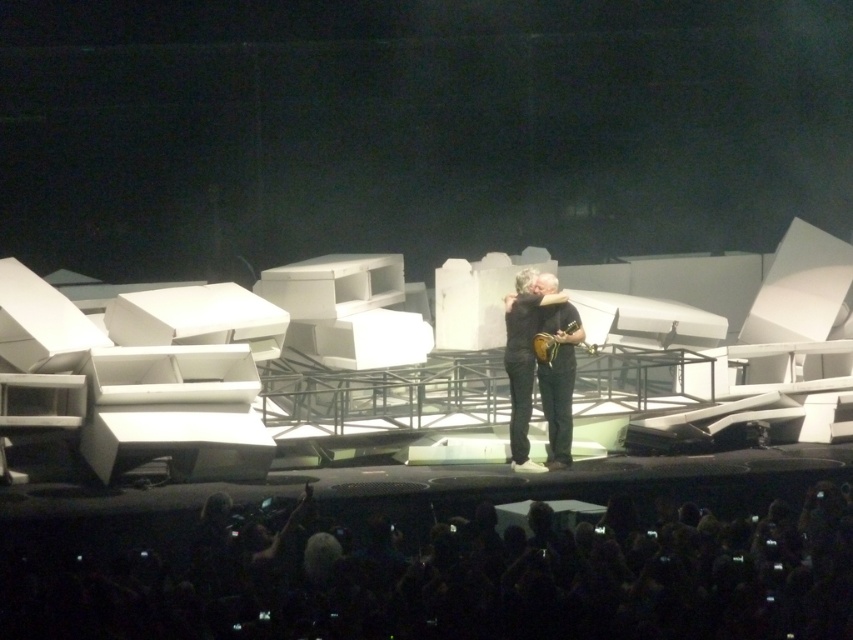
Does matte brown guitar at center appear on the left side of gold metallic guitar at center?

Indeed, matte brown guitar at center is positioned on the left side of gold metallic guitar at center.

Does point (556, 300) lie behind point (560, 332)?

No, (556, 300) is in front of (560, 332).

At what (x,y) coordinates should I click in order to perform the action: click on matte brown guitar at center. Please return your answer as a coordinate pair (x, y). Looking at the image, I should click on point(524,355).